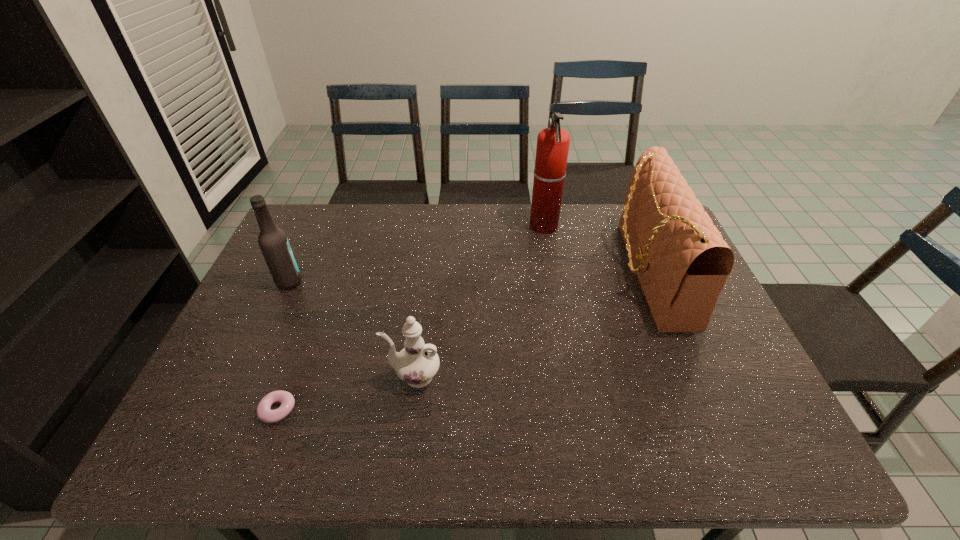
Find the location of a particular element. the third closest object to the beer bottle is located at coordinates (553, 143).

Find the location of `the fourth closest object to the second object from right to left`. the fourth closest object to the second object from right to left is located at coordinates (264, 413).

The height and width of the screenshot is (540, 960). I want to click on free spot that satisfies the following two spatial constraints: 1. on the label of the leftmost object; 2. on the right side of the second object from left to right, so pyautogui.click(x=230, y=410).

Locate an element on the screen. Image resolution: width=960 pixels, height=540 pixels. free space that satisfies the following two spatial constraints: 1. on the label of the shortest object; 2. on the left side of the beer bottle is located at coordinates (230, 410).